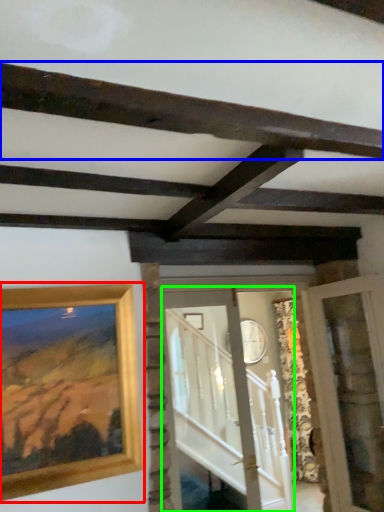
Question: Estimate the real-world distances between objects in this image. Which object is closer to picture frame (highlighted by a red box), plank (highlighted by a blue box) or glass door (highlighted by a green box)?

Choices:
 (A) plank
 (B) glass door

Answer: (A)